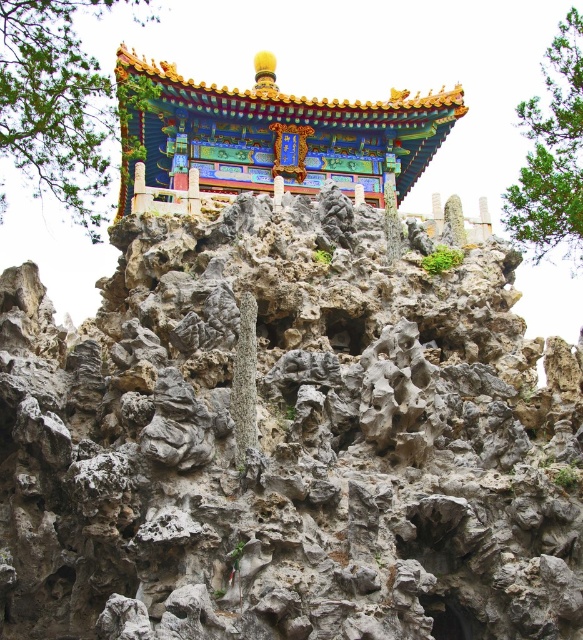
Question: Can you confirm if green textured tree at upper left is thinner than green leafy tree at upper right?

Choices:
 (A) yes
 (B) no

Answer: (A)

Question: Is shiny lacquered pavilion at center closer to the viewer compared to green leafy tree at upper right?

Choices:
 (A) no
 (B) yes

Answer: (A)

Question: Which object is farther from the camera taking this photo?

Choices:
 (A) shiny lacquered pavilion at center
 (B) gray rough rock face at center

Answer: (A)

Question: Where is shiny lacquered pavilion at center located in relation to green leafy tree at upper right in the image?

Choices:
 (A) left
 (B) right

Answer: (A)

Question: Which point is closer to the camera taking this photo?

Choices:
 (A) (373, 116)
 (B) (545, 204)

Answer: (B)

Question: Among these objects, which one is farthest from the camera?

Choices:
 (A) shiny lacquered pavilion at center
 (B) green leafy tree at upper right
 (C) green textured tree at upper left
 (D) gray rough rock face at center

Answer: (A)